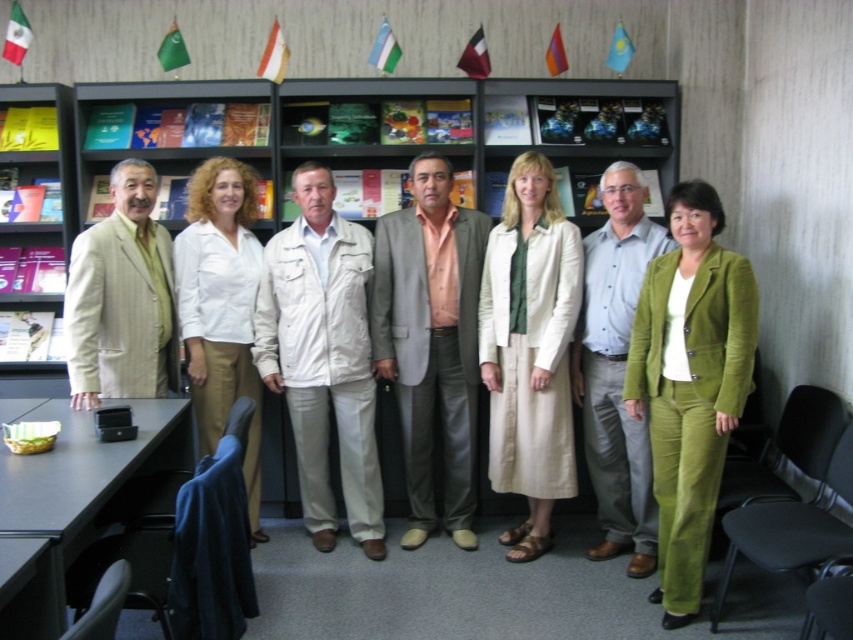
You are organizing a presentation and need to place a laptop between the wooden bookshelf at center and the white cotton jacket at center. Based on their positions, which side of the jacket should the laptop be placed to ensure it is between them?

The wooden bookshelf at center is positioned on the left side of the white cotton jacket at center, so the laptop should be placed to the left of the jacket to be between them.

You are a photographer arranging a group photo. You notice the green corduroy suit at center and the white cotton blouse at center. Which clothing item should you move to the left to create more balance in the composition?

The green corduroy suit at center should be moved to the left to balance the composition since it is currently positioned on the right side of the white cotton blouse at center.

Based on the photo, you are a photographer adjusting the lighting for a group photo. You notice the green corduroy suit at center and the white cotton blouse at center. Which clothing item requires more space in the frame to avoid being cut off?

The green corduroy suit at center is larger in size than the white cotton blouse at center, so it requires more space in the frame to avoid being cut off.